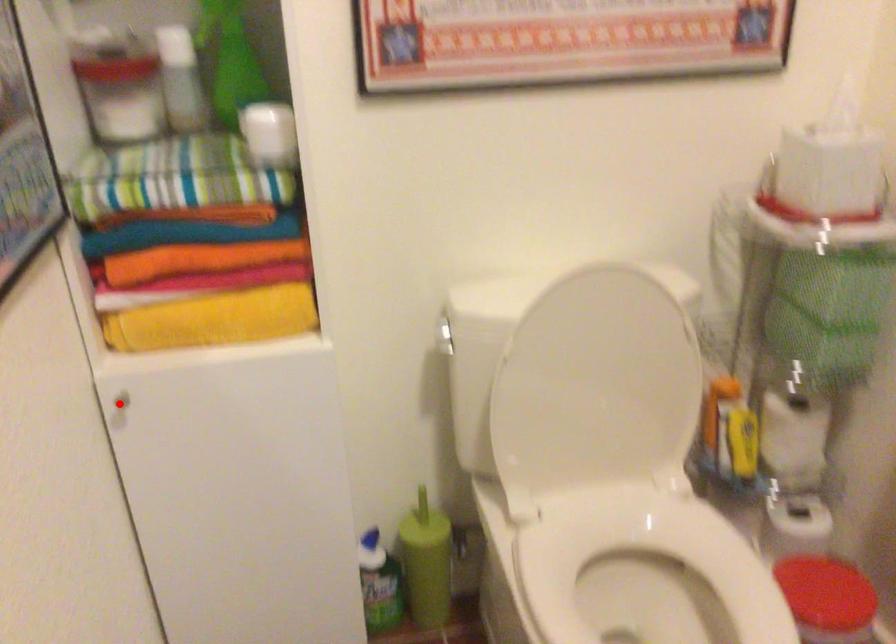
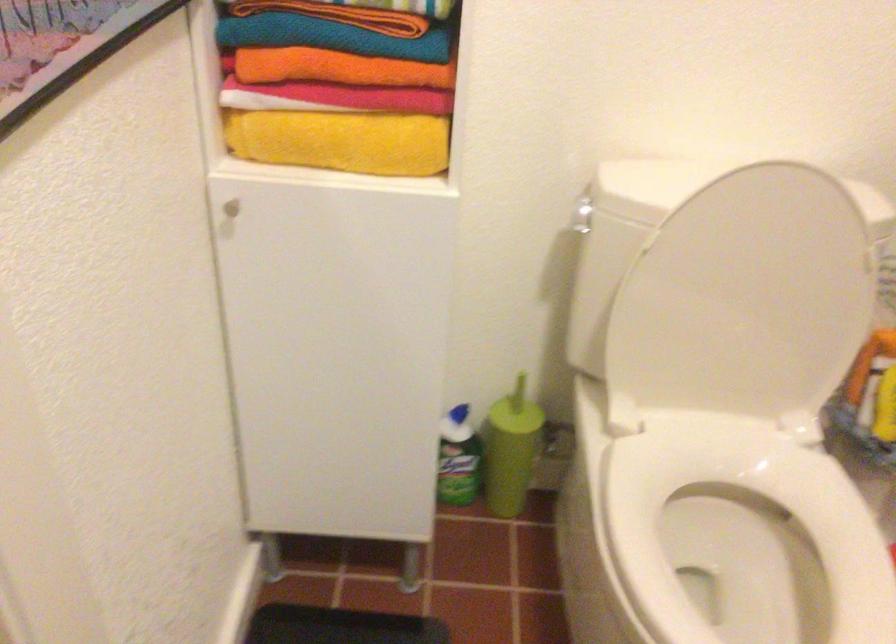
In the second image, find the point that corresponds to the highlighted location in the first image.

(228, 210)